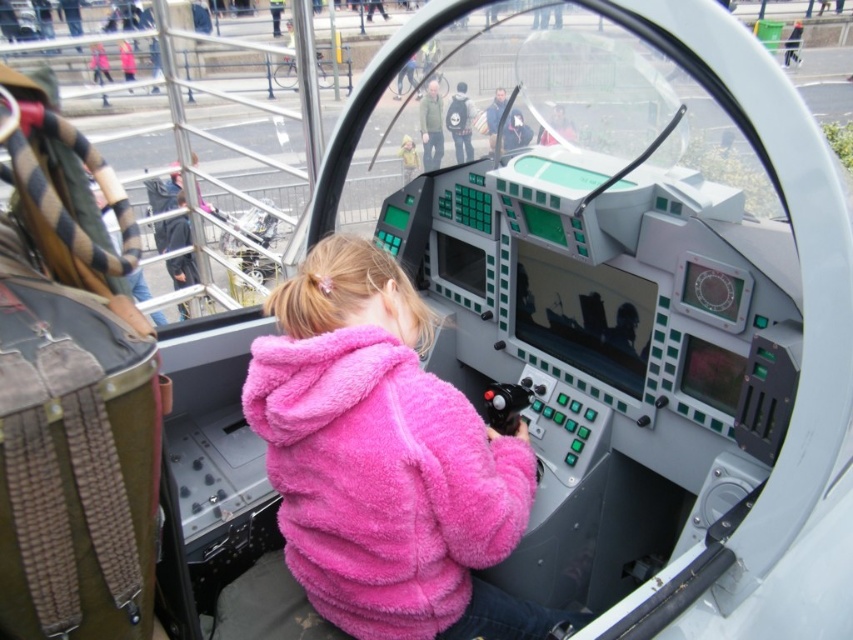
Does green matte jacket at upper center appear under matte black backpack at center?

No.

Locate an element on the screen. The height and width of the screenshot is (640, 853). green matte jacket at upper center is located at coordinates (431, 125).

Where is `green matte jacket at upper center`? This screenshot has height=640, width=853. green matte jacket at upper center is located at coordinates (431, 125).

Is fuzzy pink jacket at center to the left of matte black helmet at upper center from the viewer's perspective?

Indeed, fuzzy pink jacket at center is positioned on the left side of matte black helmet at upper center.

Based on the photo, is fuzzy pink jacket at center positioned in front of matte black helmet at upper center?

That is True.

Locate an element on the screen. fuzzy pink jacket at center is located at coordinates click(386, 460).

Is point (428, 161) positioned before point (561, 120)?

That is False.

Is point (424, 129) farther from camera compared to point (554, 140)?

Yes.

Does point (422, 125) come farther from viewer compared to point (556, 116)?

Yes, point (422, 125) is behind point (556, 116).

Find the location of a particular element. The height and width of the screenshot is (640, 853). green matte jacket at upper center is located at coordinates (431, 125).